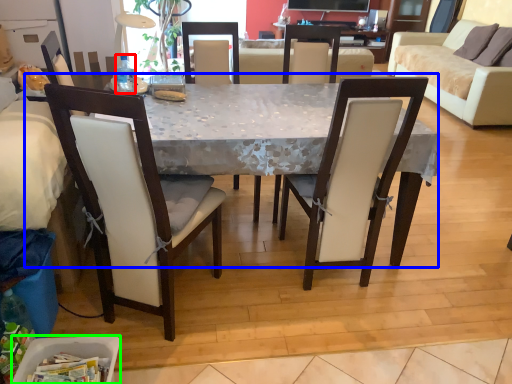
Question: Based on their relative distances, which object is nearer to bottle (highlighted by a red box)? Choose from desk (highlighted by a blue box) and trash bin/can (highlighted by a green box).

Choices:
 (A) desk
 (B) trash bin/can

Answer: (A)